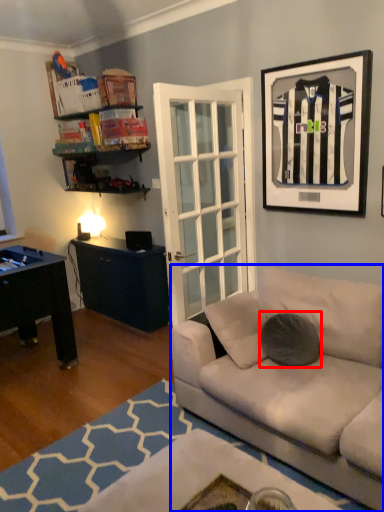
Question: Which of the following is the farthest to the observer, pillow (highlighted by a red box) or studio couch (highlighted by a blue box)?

Choices:
 (A) pillow
 (B) studio couch

Answer: (A)